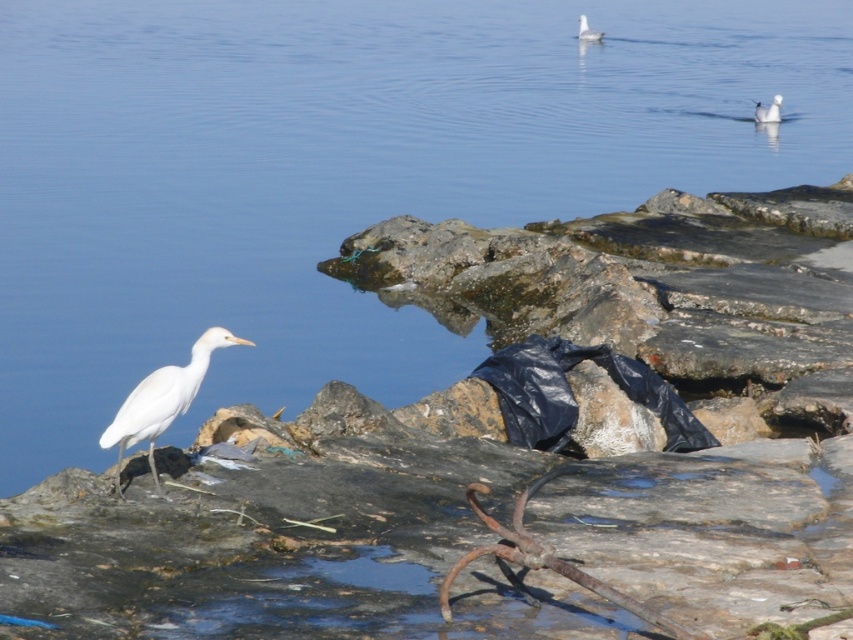
Question: Among these points, which one is nearest to the camera?

Choices:
 (A) (769, 120)
 (B) (173, 385)

Answer: (B)

Question: Considering the relative positions of white matte bird at upper right and white matte bird at upper center in the image provided, where is white matte bird at upper right located with respect to white matte bird at upper center?

Choices:
 (A) left
 (B) right

Answer: (B)

Question: Which point is farther to the camera?

Choices:
 (A) white matte bird at left
 (B) white matte bird at upper right

Answer: (B)

Question: Can you confirm if white matte bird at upper right is positioned to the left of white matte bird at upper center?

Choices:
 (A) yes
 (B) no

Answer: (B)

Question: Which point appears farthest from the camera in this image?

Choices:
 (A) (222, 326)
 (B) (773, 112)

Answer: (B)

Question: Can you confirm if white matte bird at left is positioned to the right of white matte bird at upper right?

Choices:
 (A) no
 (B) yes

Answer: (A)